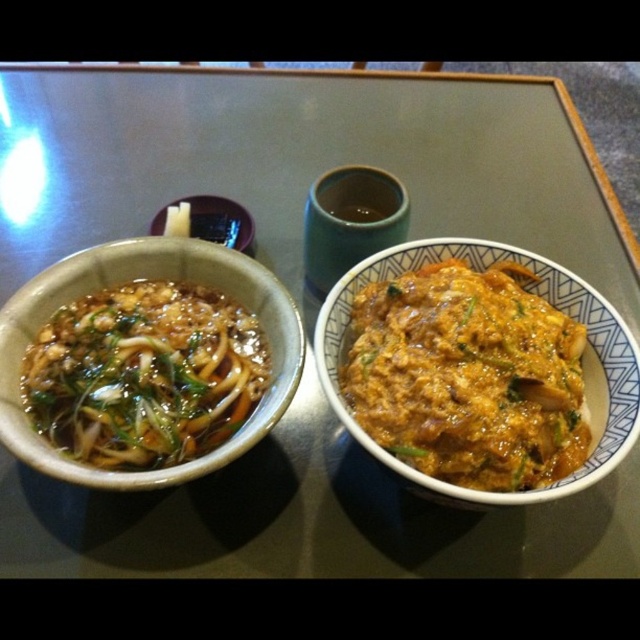
Is point (186, 323) less distant than point (218, 214)?

Yes, it is.

This screenshot has width=640, height=640. What do you see at coordinates (145, 374) in the screenshot?
I see `slightly glossy noodles at left` at bounding box center [145, 374].

Does point (160, 365) lie behind point (209, 227)?

No, it is in front of (209, 227).

Identify the location of slightly glossy noodles at left. The height and width of the screenshot is (640, 640). (145, 374).

Can you confirm if matte orange curry at right is smaller than matte ceramic bowl at center?

No.

Does matte orange curry at right appear on the right side of matte ceramic bowl at center?

Indeed, matte orange curry at right is positioned on the right side of matte ceramic bowl at center.

Does point (515, 384) lie behind point (244, 230)?

No, (515, 384) is closer to viewer.

In order to click on matte orange curry at right in this screenshot , I will do `click(467, 376)`.

Between matte orange curry at right and slightly glossy noodles at left, which one is positioned lower?

matte orange curry at right is below.

Does matte orange curry at right have a smaller size compared to slightly glossy noodles at left?

No.

This screenshot has width=640, height=640. In order to click on matte orange curry at right in this screenshot , I will do pyautogui.click(x=467, y=376).

Locate an element on the screen. The height and width of the screenshot is (640, 640). matte orange curry at right is located at coordinates (467, 376).